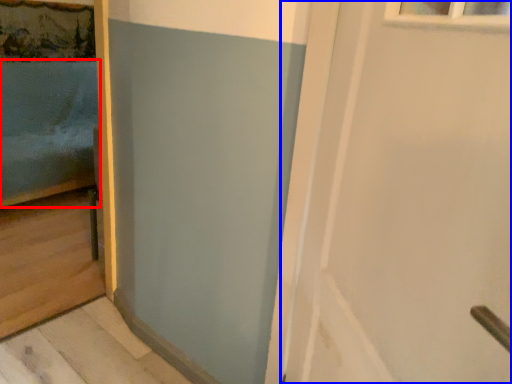
Question: Which object is closer to the camera taking this photo, bed (highlighted by a red box) or door (highlighted by a blue box)?

Choices:
 (A) bed
 (B) door

Answer: (B)